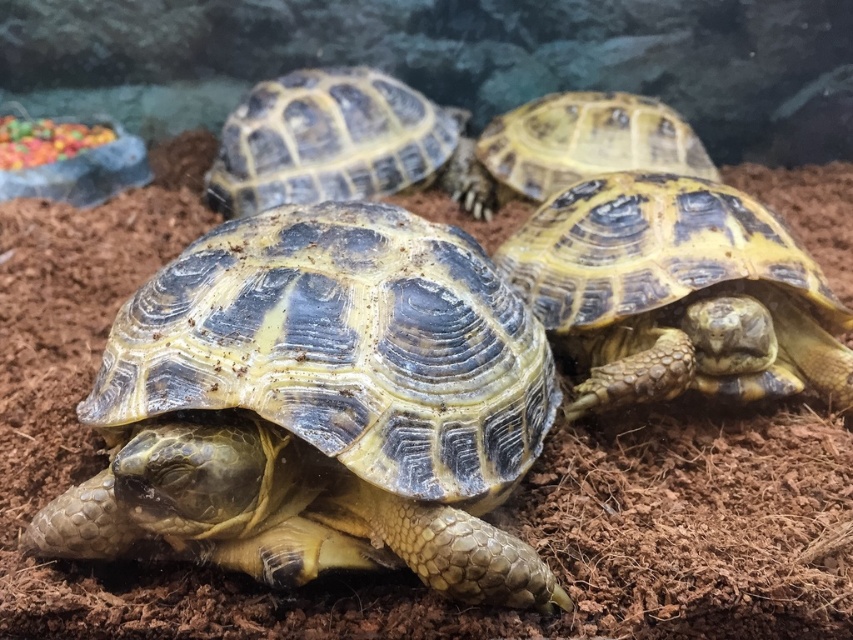
You are a zookeeper looking at the turtles in their enclosure. You notice two points marked in the image. If you were to walk towards the turtles, which point would you reach first, the point at coordinate (283,102) or the point at coordinate (582,173)?

The point at coordinate (283,102) is closer to you than the point at coordinate (582,173), so you would reach it first.